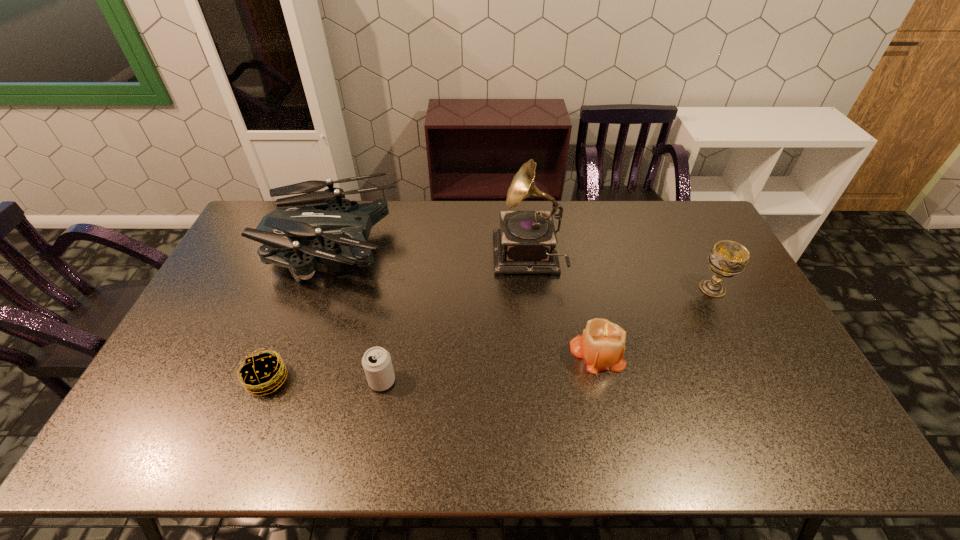
Where is `vacant area between the candle and the patty`? The image size is (960, 540). vacant area between the candle and the patty is located at coordinates (432, 367).

This screenshot has width=960, height=540. Find the location of `vacant region between the chalice and the record player`. vacant region between the chalice and the record player is located at coordinates (620, 274).

Where is `vacant area between the can and the shortest object`? The width and height of the screenshot is (960, 540). vacant area between the can and the shortest object is located at coordinates tap(324, 380).

The width and height of the screenshot is (960, 540). I want to click on object that can be found as the closest to the fifth tallest object, so click(262, 373).

Choose which object is the fifth nearest neighbor to the tallest object. Please provide its 2D coordinates. Your answer should be formatted as a tuple, i.e. [(x, y)], where the tuple contains the x and y coordinates of a point satisfying the conditions above.

[(262, 373)]

Identify the location of free point that satisfies the following two spatial constraints: 1. on the horn of the record player; 2. on the right side of the chalice. (531, 288).

The image size is (960, 540). Identify the location of free space that satisfies the following two spatial constraints: 1. on the horn of the tallest object; 2. on the right side of the chalice. (531, 288).

Identify the location of vacant area that satisfies the following two spatial constraints: 1. on the horn of the tallest object; 2. on the back side of the chalice. This screenshot has height=540, width=960. (531, 288).

This screenshot has height=540, width=960. In order to click on vacant space that satisfies the following two spatial constraints: 1. on the horn of the chalice; 2. on the left side of the record player in this screenshot , I will do `click(531, 288)`.

Identify the location of vacant space that satisfies the following two spatial constraints: 1. on the horn of the tallest object; 2. on the right side of the rightmost object. (531, 288).